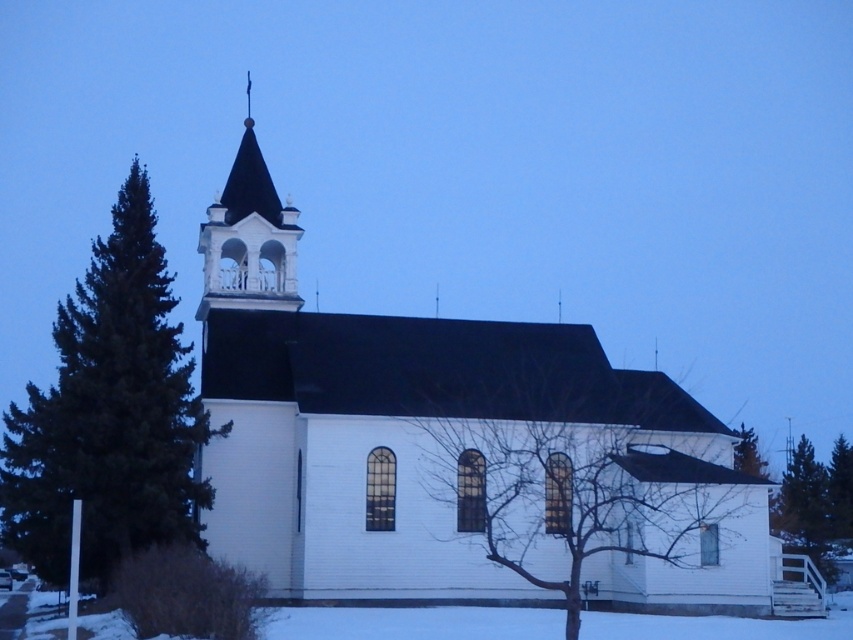
Question: Is white wood church at center positioned at the back of green leafy tree at upper right?

Choices:
 (A) yes
 (B) no

Answer: (B)

Question: Which is farther from the white wood spire at upper center?

Choices:
 (A) white wood church at center
 (B) green coniferous tree at left
 (C) bare branches at center
 (D) green leafy tree at upper right

Answer: (D)

Question: Which of the following is the closest to the observer?

Choices:
 (A) white wood spire at upper center
 (B) white wood church at center
 (C) bare branches at center
 (D) green coniferous tree at left

Answer: (C)

Question: Does white wood church at center have a greater width compared to white wood spire at upper center?

Choices:
 (A) no
 (B) yes

Answer: (B)

Question: Which object is closer to the camera taking this photo?

Choices:
 (A) green coniferous tree at left
 (B) white wood spire at upper center
 (C) white wood church at center
 (D) green leafy tree at upper right

Answer: (C)

Question: Can you confirm if white wood church at center is smaller than green leafy tree at upper right?

Choices:
 (A) no
 (B) yes

Answer: (A)